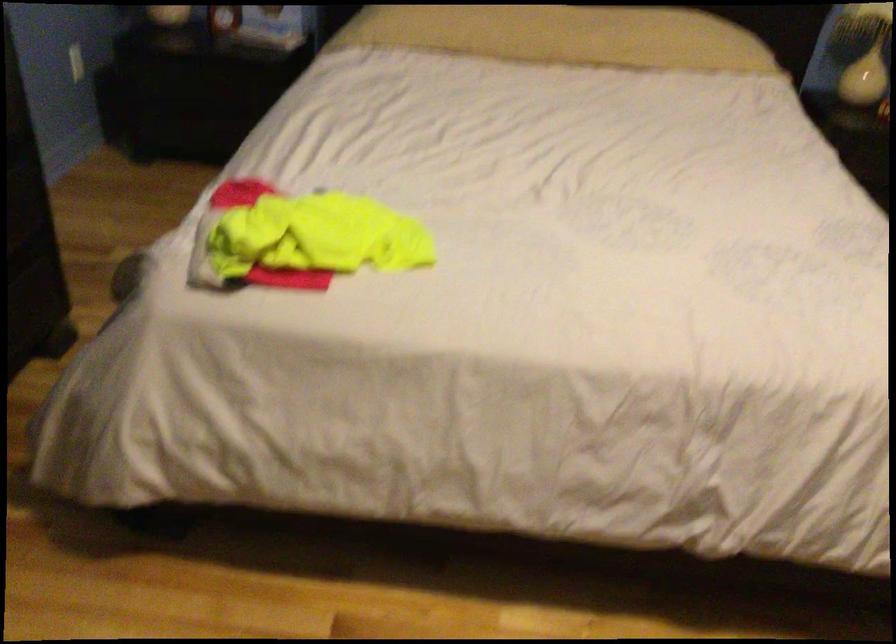
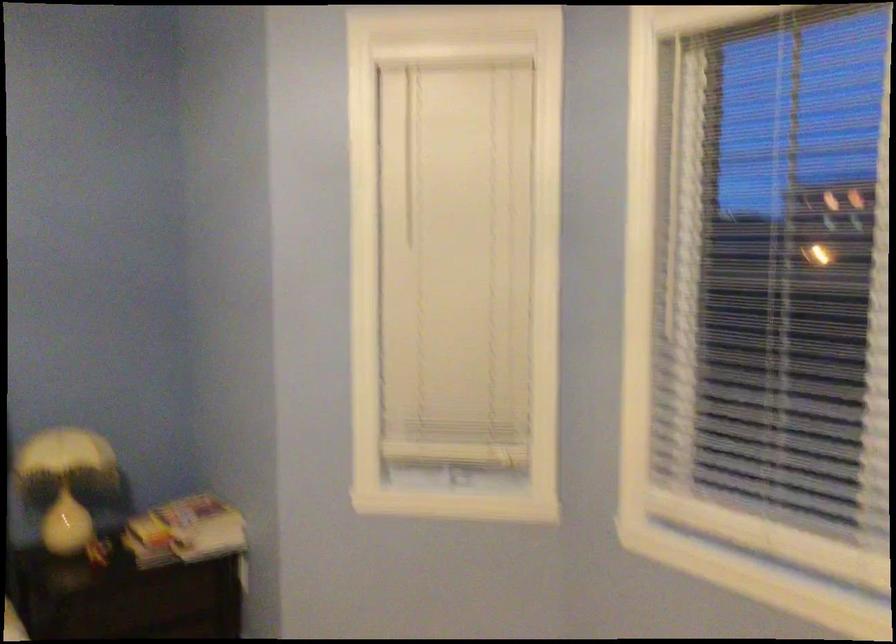
In the scene shown: First-person continuous shooting, in which direction is the camera rotating?

The rotation direction of the camera is right-up.